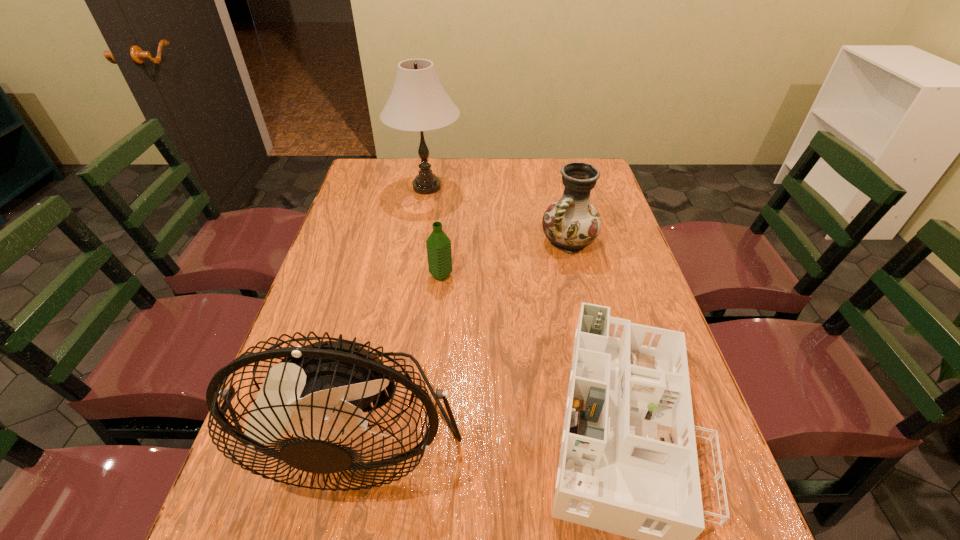
The image size is (960, 540). Find the location of `free spot between the third tallest object and the third nearest object`. free spot between the third tallest object and the third nearest object is located at coordinates (505, 259).

Image resolution: width=960 pixels, height=540 pixels. I want to click on object that stands as the fourth closest to the vase, so pyautogui.click(x=322, y=390).

Identify which object is located as the nearest to the dollhouse. Please provide its 2D coordinates. Your answer should be formatted as a tuple, i.e. [(x, y)], where the tuple contains the x and y coordinates of a point satisfying the conditions above.

[(322, 390)]